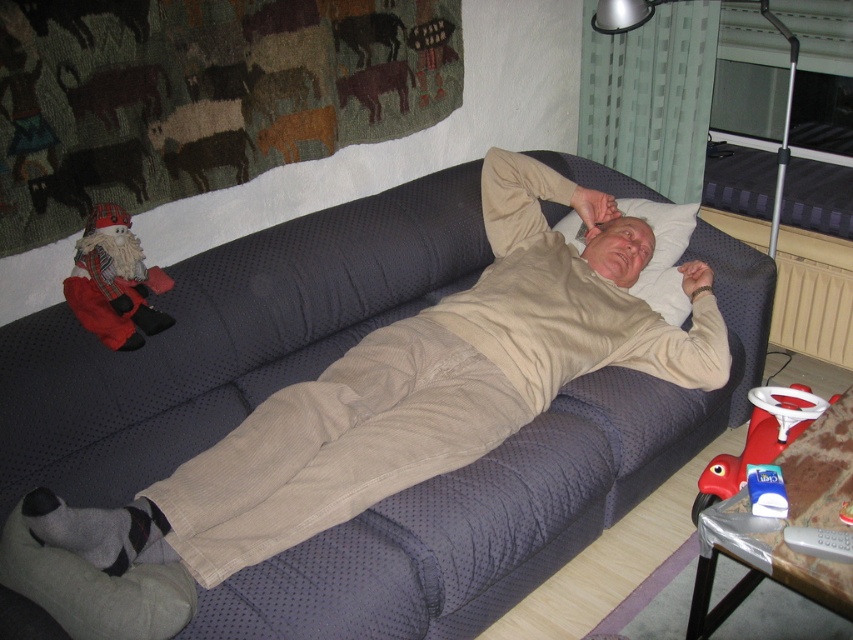
Is point (737, 358) farther from camera compared to point (114, 326)?

That is True.

Does dark blue textured couch at center appear on the right side of red plaid santa at left?

Indeed, dark blue textured couch at center is positioned on the right side of red plaid santa at left.

Is point (456, 618) less distant than point (109, 328)?

Yes, point (456, 618) is in front of point (109, 328).

Locate an element on the screen. dark blue textured couch at center is located at coordinates (225, 339).

Can you confirm if red plaid santa at left is positioned to the right of white soft pillow at upper center?

No, red plaid santa at left is not to the right of white soft pillow at upper center.

Does red plaid santa at left have a smaller size compared to white soft pillow at upper center?

Correct, red plaid santa at left occupies less space than white soft pillow at upper center.

Is point (90, 316) positioned behind point (564, 228)?

No, (90, 316) is closer to viewer.

This screenshot has width=853, height=640. I want to click on red plaid santa at left, so click(x=114, y=282).

In the scene shown: Can you confirm if dark blue textured couch at center is positioned to the left of white soft pillow at upper center?

Correct, you'll find dark blue textured couch at center to the left of white soft pillow at upper center.

Between dark blue textured couch at center and white soft pillow at upper center, which one has less height?

white soft pillow at upper center

Locate an element on the screen. The width and height of the screenshot is (853, 640). dark blue textured couch at center is located at coordinates (225, 339).